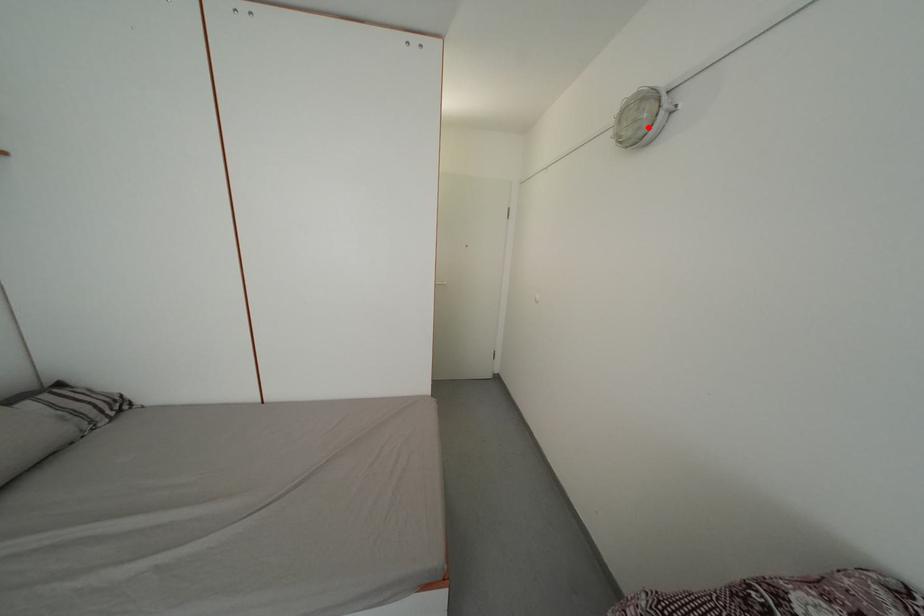
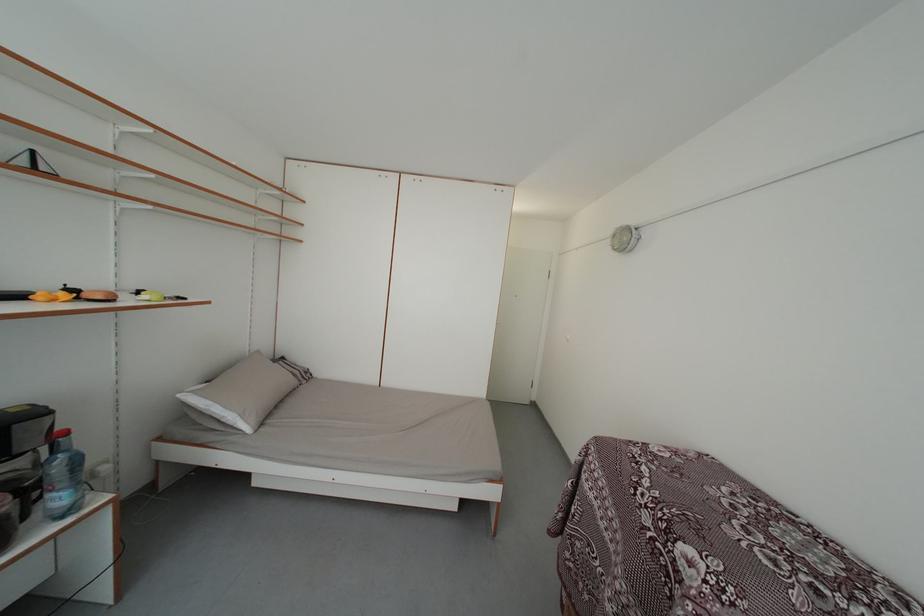
In the second image, find the point that corresponds to the highlighted location in the first image.

(631, 246)